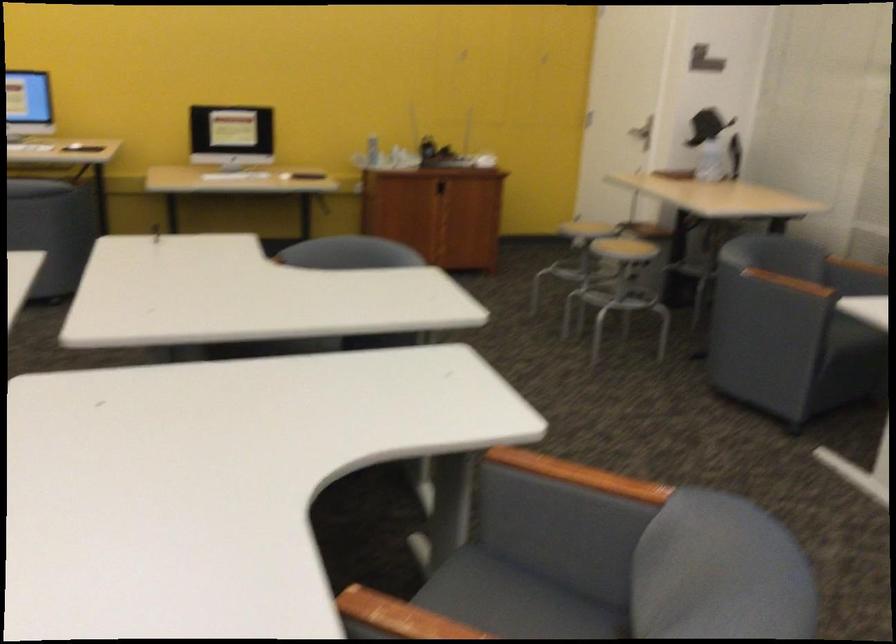
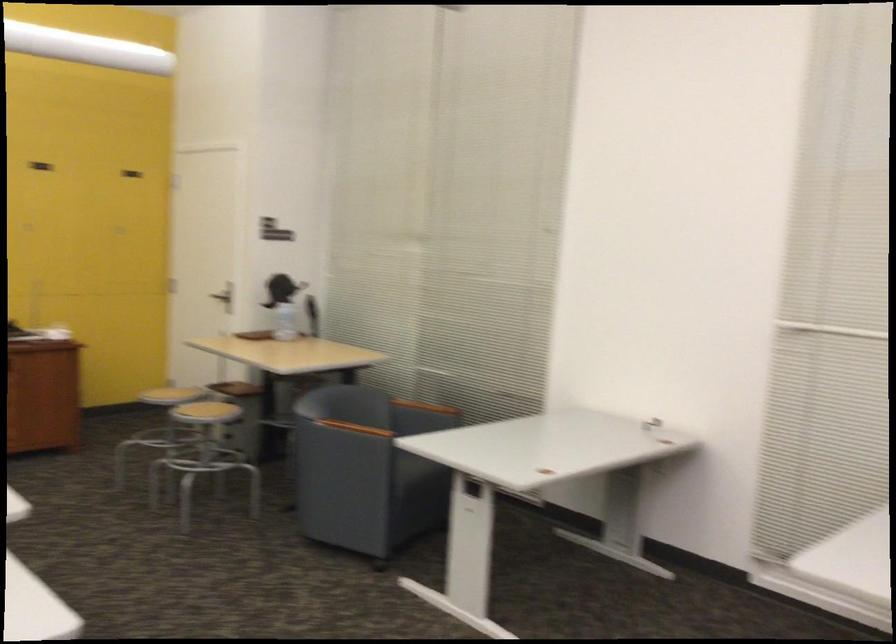
Question: The camera is either moving clockwise (left) or counter-clockwise (right) around the object. The first image is from the beginning of the video and the second image is from the end. Is the camera moving left or right when shooting the video?

Choices:
 (A) Left
 (B) Right

Answer: (A)